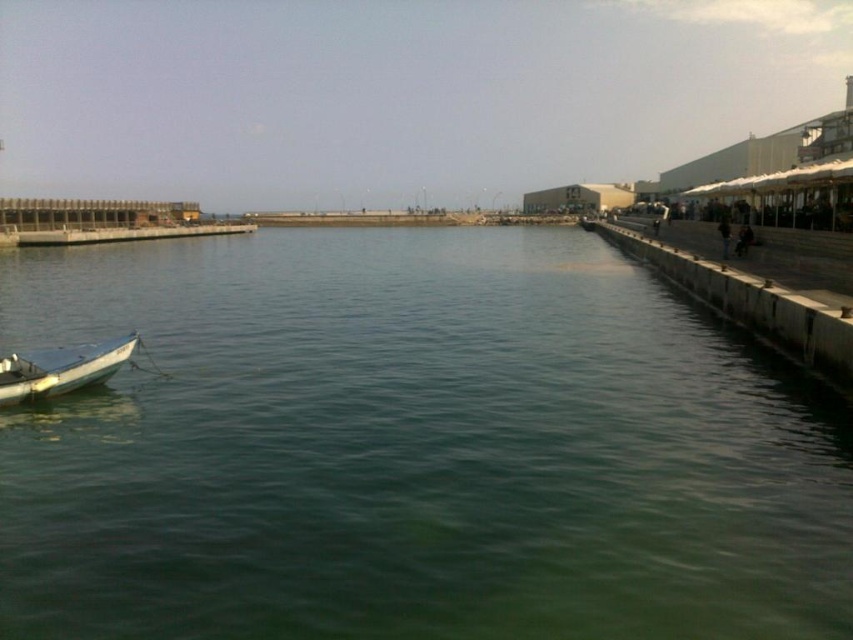
Question: Does concrete at right lie behind white matte boat at left?

Choices:
 (A) no
 (B) yes

Answer: (B)

Question: Which of the following is the farthest from the observer?

Choices:
 (A) green water at center
 (B) white matte boat at left

Answer: (B)

Question: Does concrete at right have a larger size compared to white matte boat at left?

Choices:
 (A) no
 (B) yes

Answer: (B)

Question: Where is concrete at right located in relation to white matte boat at left in the image?

Choices:
 (A) left
 (B) right

Answer: (B)

Question: Which point appears farthest from the camera in this image?

Choices:
 (A) (531, 403)
 (B) (721, 304)

Answer: (B)

Question: Considering the real-world distances, which object is farthest from the green water at center?

Choices:
 (A) concrete at right
 (B) white matte boat at left

Answer: (A)